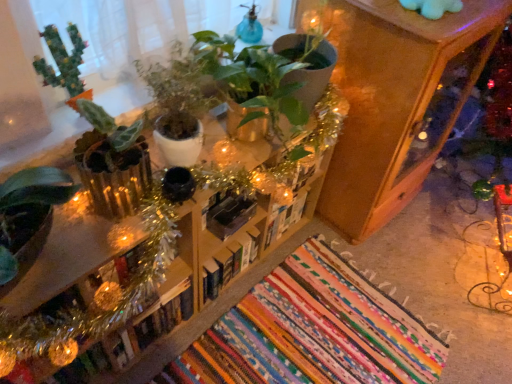
Question: Is hardcover book at center, which is the third book in right-to-left order, at the back of green matte plant at center, which ranks as the 2th houseplant in left-to-right order?

Choices:
 (A) yes
 (B) no

Answer: (B)

Question: Can you confirm if green matte plant at center, which ranks as the 2th houseplant in left-to-right order, is bigger than hardcover book at center, which is the third book in right-to-left order?

Choices:
 (A) yes
 (B) no

Answer: (A)

Question: Is green matte plant at center, which ranks as the 2th houseplant in left-to-right order, shorter than hardcover book at center, which is the third book in right-to-left order?

Choices:
 (A) no
 (B) yes

Answer: (A)

Question: Is green matte plant at center, which is the first houseplant in right-to-left order, further to camera compared to hardcover book at center, arranged as the second book when viewed from the left?

Choices:
 (A) no
 (B) yes

Answer: (A)

Question: Is green matte plant at center, which is the first houseplant in right-to-left order, not inside hardcover book at center, arranged as the second book when viewed from the left?

Choices:
 (A) no
 (B) yes

Answer: (B)

Question: Would you consider green matte plant at center, which ranks as the 2th houseplant in left-to-right order, to be distant from hardcover book at center, which is the third book in right-to-left order?

Choices:
 (A) yes
 (B) no

Answer: (B)

Question: Can you confirm if black matte bookshelf at center, the 3th book in the left-to-right sequence, is smaller than hardcover book at center, the first book in the left-to-right sequence?

Choices:
 (A) no
 (B) yes

Answer: (B)

Question: From a real-world perspective, is black matte bookshelf at center, the second book positioned from the right, over hardcover book at center, the fourth book viewed from the right?

Choices:
 (A) yes
 (B) no

Answer: (A)

Question: Could you tell me if black matte bookshelf at center, the second book positioned from the right, is facing hardcover book at center, the fourth book viewed from the right?

Choices:
 (A) yes
 (B) no

Answer: (B)

Question: Can you confirm if black matte bookshelf at center, the 3th book in the left-to-right sequence, is taller than hardcover book at center, the fourth book viewed from the right?

Choices:
 (A) yes
 (B) no

Answer: (B)

Question: Does black matte bookshelf at center, the 3th book in the left-to-right sequence, contain hardcover book at center, the fourth book viewed from the right?

Choices:
 (A) no
 (B) yes

Answer: (A)

Question: Can we say black matte bookshelf at center, the 3th book in the left-to-right sequence, lies outside hardcover book at center, the first book in the left-to-right sequence?

Choices:
 (A) yes
 (B) no

Answer: (A)

Question: Is black matte bookshelf at center, the second book positioned from the right, further to camera compared to white matte book at center, acting as the 1th book starting from the right?

Choices:
 (A) no
 (B) yes

Answer: (A)